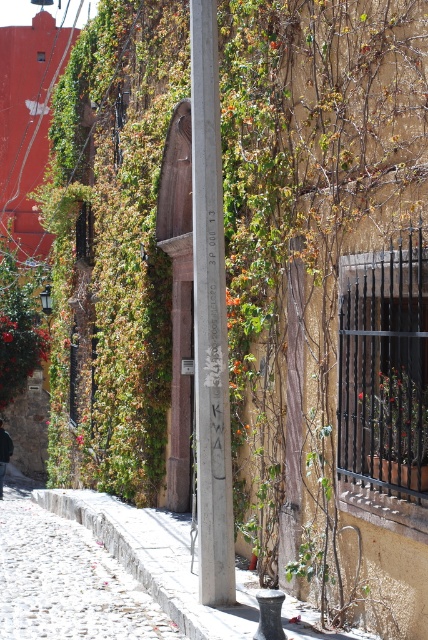
You are a street artist planning to paint a mural on the building. You notice the white cobblestone at lower left and the green leafy plant at center. Which object has a greater width?

The white cobblestone at lower left has a greater width than the green leafy plant at center.

You are a delivery person carrying a box that is 10 feet long. You need to place it between the white cobblestone at lower left and the green leafy plant at center. Will the box fit in the space between them?

The distance between the white cobblestone at lower left and the green leafy plant at center is 11.69 feet. Since the box is 10 feet long, it will fit with some space to spare.